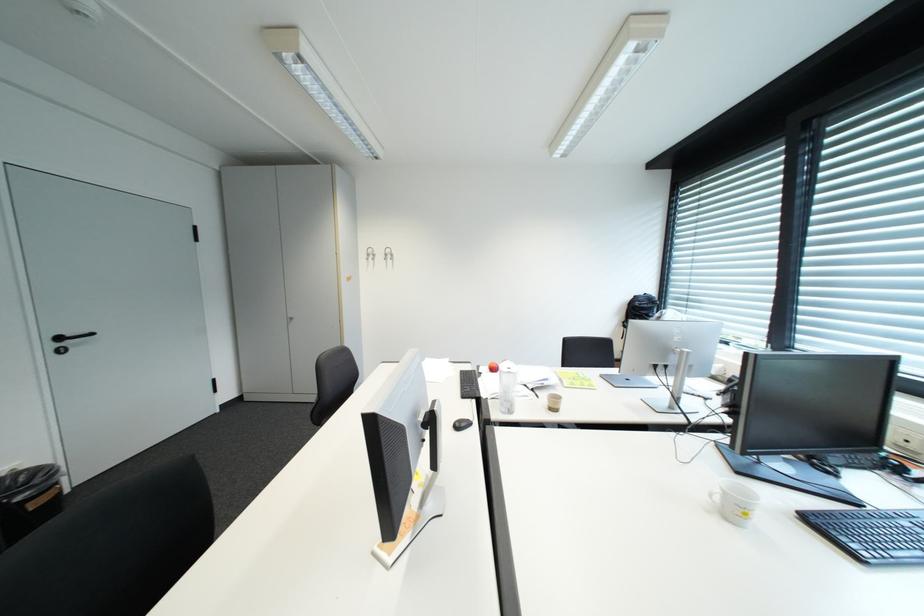
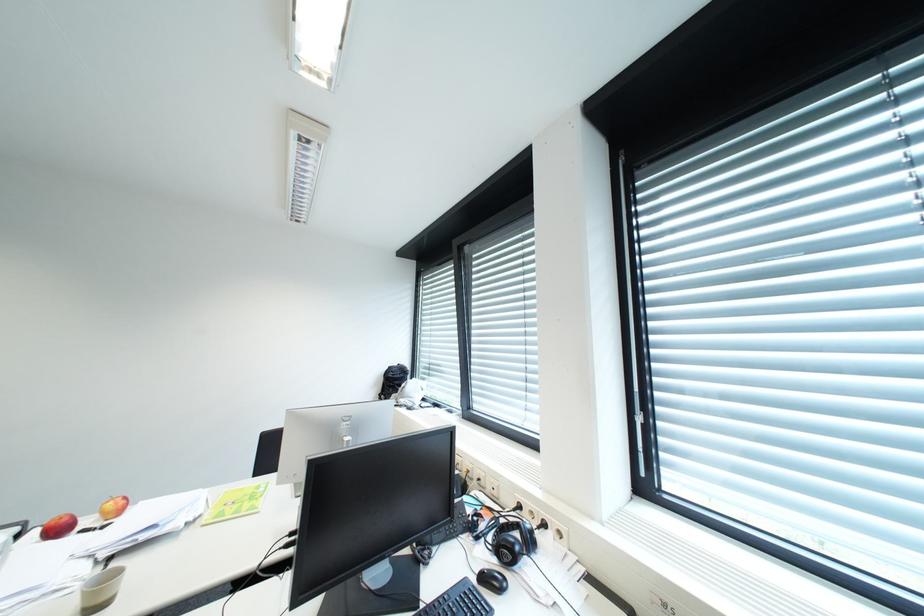
Question: Based on the continuous images, in which direction is the camera rotating? Reply with the corresponding letter.

Choices:
 (A) Left
 (B) Right
 (C) Up
 (D) Down

Answer: (B)